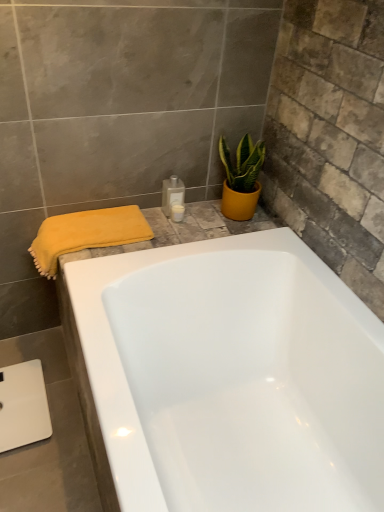
Question: From a real-world perspective, is yellow matte pot at upper right under translucent plastic bottle at upper center, the first toiletry from the top?

Choices:
 (A) yes
 (B) no

Answer: (B)

Question: Does yellow matte pot at upper right have a lesser height compared to translucent plastic bottle at upper center, the first toiletry from the top?

Choices:
 (A) yes
 (B) no

Answer: (B)

Question: Is yellow matte pot at upper right bigger than translucent plastic bottle at upper center, which is counted as the second toiletry, starting from the bottom?

Choices:
 (A) yes
 (B) no

Answer: (A)

Question: Does yellow matte pot at upper right have a lesser width compared to translucent plastic bottle at upper center, which is counted as the second toiletry, starting from the bottom?

Choices:
 (A) no
 (B) yes

Answer: (A)

Question: Does yellow matte pot at upper right appear on the right side of translucent plastic bottle at upper center, which is counted as the second toiletry, starting from the bottom?

Choices:
 (A) yes
 (B) no

Answer: (A)

Question: From a real-world perspective, is yellow soft towel at left positioned above or below yellow matte pot at upper right?

Choices:
 (A) below
 (B) above

Answer: (A)

Question: Looking at their shapes, would you say yellow soft towel at left is wider or thinner than yellow matte pot at upper right?

Choices:
 (A) thin
 (B) wide

Answer: (B)

Question: Do you think yellow soft towel at left is within yellow matte pot at upper right, or outside of it?

Choices:
 (A) inside
 (B) outside

Answer: (B)

Question: Does point (94, 211) appear closer or farther from the camera than point (249, 150)?

Choices:
 (A) farther
 (B) closer

Answer: (B)

Question: In terms of size, does white glossy bottle at upper center, acting as the 2th toiletry starting from the top, appear bigger or smaller than yellow soft towel at left?

Choices:
 (A) small
 (B) big

Answer: (A)

Question: Would you say white glossy bottle at upper center, marked as the 1th toiletry in a bottom-to-top arrangement, is to the left or to the right of yellow soft towel at left in the picture?

Choices:
 (A) right
 (B) left

Answer: (A)

Question: Is point (183, 204) positioned closer to the camera than point (38, 246)?

Choices:
 (A) farther
 (B) closer

Answer: (A)

Question: Is white glossy bottle at upper center, acting as the 2th toiletry starting from the top, inside the boundaries of yellow soft towel at left, or outside?

Choices:
 (A) outside
 (B) inside

Answer: (A)

Question: Is translucent plastic bottle at upper center, the first toiletry from the top, wider or thinner than white glossy bottle at upper center, acting as the 2th toiletry starting from the top?

Choices:
 (A) wide
 (B) thin

Answer: (A)

Question: Is translucent plastic bottle at upper center, the first toiletry from the top, taller or shorter than white glossy bottle at upper center, acting as the 2th toiletry starting from the top?

Choices:
 (A) tall
 (B) short

Answer: (A)